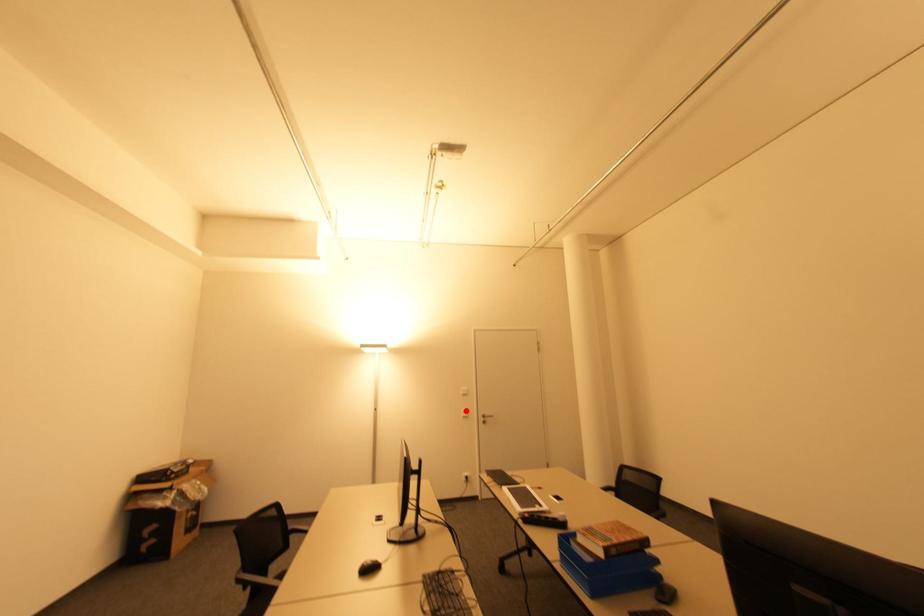
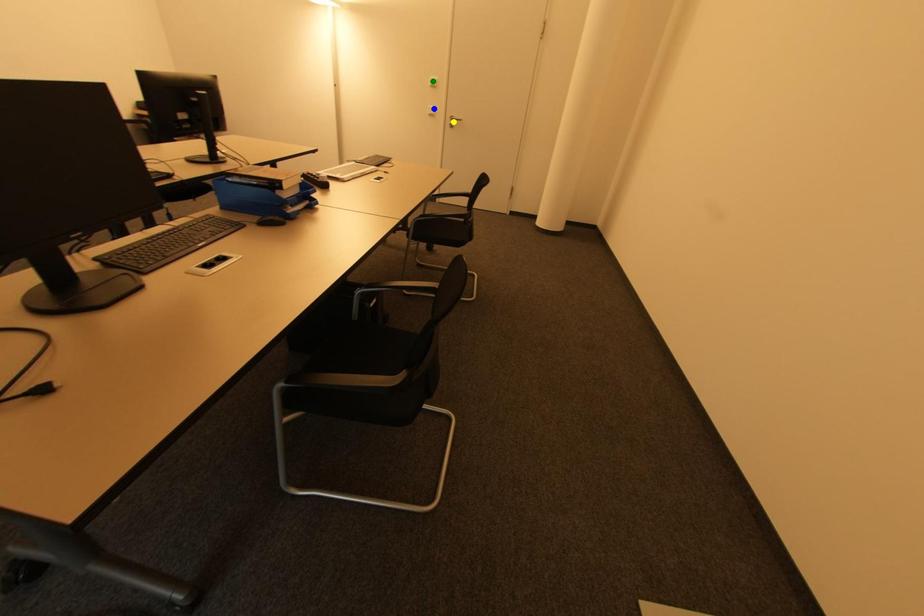
Question: I am providing you with two images of the same scene from different viewpoints. A red point is marked on the first image. You are given multiple points on the second image. Which point in image 2 represents the same 3d spot as the red point in image 1?

Choices:
 (A) blue point
 (B) green point
 (C) yellow point

Answer: (A)